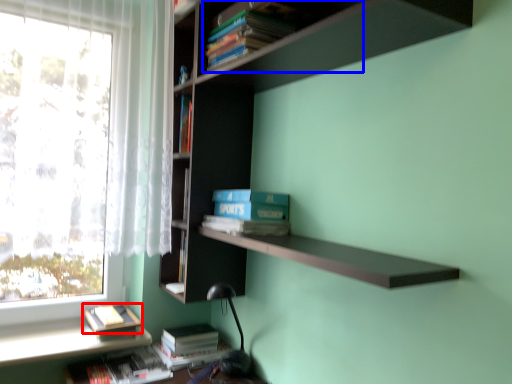
Question: Which point is further to the camera, book (highlighted by a red box) or book (highlighted by a blue box)?

Choices:
 (A) book
 (B) book

Answer: (A)